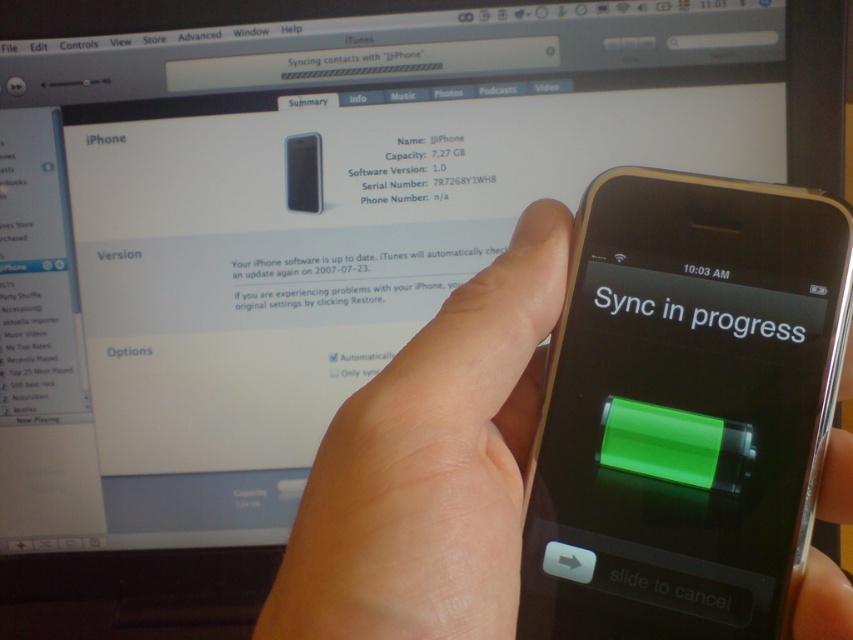
Does black matte iphone at center have a greater height compared to green matte text at center?

Indeed, black matte iphone at center has a greater height compared to green matte text at center.

Does black matte iphone at center appear on the left side of green matte text at center?

Indeed, black matte iphone at center is positioned on the left side of green matte text at center.

Does point (438, 168) come behind point (766, 328)?

That is True.

The image size is (853, 640). I want to click on black matte iphone at center, so click(x=416, y=172).

Can you confirm if skinny white hand at center is shorter than green matte text at center?

No.

Can you confirm if skinny white hand at center is positioned above green matte text at center?

No.

Measure the distance between skinny white hand at center and camera.

skinny white hand at center is 10.15 inches away from camera.

Locate an element on the screen. Image resolution: width=853 pixels, height=640 pixels. skinny white hand at center is located at coordinates (431, 467).

Is skinny white hand at center wider than black matte iphone at center?

Yes, skinny white hand at center is wider than black matte iphone at center.

Is point (454, 328) farther from viewer compared to point (370, 186)?

No, (454, 328) is in front of (370, 186).

Is point (828, 595) in front of point (363, 189)?

Yes, point (828, 595) is in front of point (363, 189).

I want to click on skinny white hand at center, so click(431, 467).